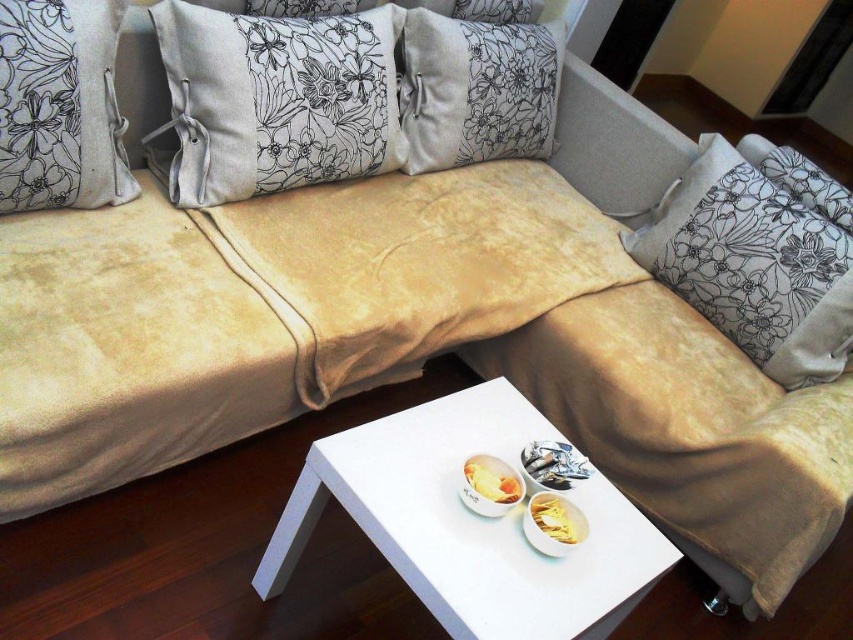
Is white glossy table at center smaller than yellow matte chips at center?

No.

Is white glossy table at center shorter than yellow matte chips at center?

In fact, white glossy table at center may be taller than yellow matte chips at center.

Locate an element on the screen. This screenshot has height=640, width=853. white glossy table at center is located at coordinates click(473, 522).

Where is `white glossy table at center`? Image resolution: width=853 pixels, height=640 pixels. white glossy table at center is located at coordinates (473, 522).

Is white glossy table at center above floral-patterned fabric pillow at upper right?

No, white glossy table at center is not above floral-patterned fabric pillow at upper right.

Does white glossy table at center appear under floral-patterned fabric pillow at upper right?

Yes.

Who is more distant from viewer, (606, 602) or (701, 241)?

The point (701, 241) is behind.

The width and height of the screenshot is (853, 640). What are the coordinates of `white glossy table at center` in the screenshot? It's located at (473, 522).

Consider the image. Does beige fabric pillow at upper left appear under velvet floral pillow at center?

Yes.

Consider the image. Does beige fabric pillow at upper left appear on the left side of velvet floral pillow at center?

Indeed, beige fabric pillow at upper left is positioned on the left side of velvet floral pillow at center.

You are a GUI agent. You are given a task and a screenshot of the screen. Output one action in this format:
    pyautogui.click(x=<x>, y=<y>)
    Task: Click on the beige fabric pillow at upper left
    
    Given the screenshot: What is the action you would take?
    pyautogui.click(x=61, y=106)